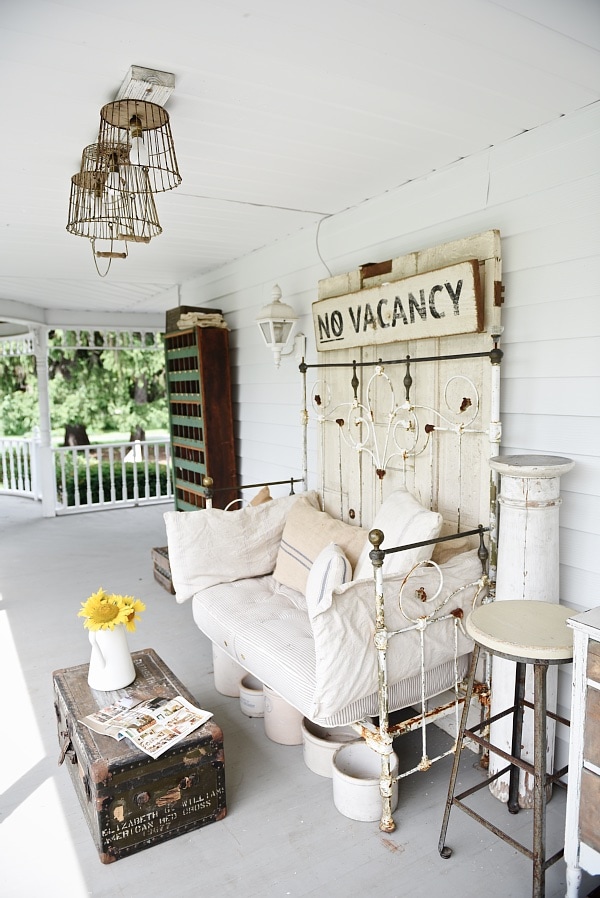
Locate an element on the screen. This screenshot has width=600, height=898. the chest is located at coordinates (129, 794).